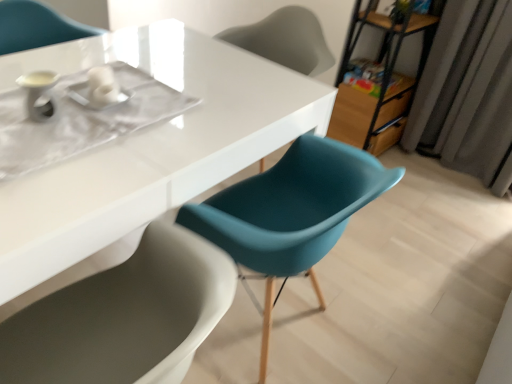
At what (x,y) coordinates should I click in order to perform the action: click on free spot above white glossy table at center (from a real-world perspective). Please return your answer as a coordinate pair (x, y). The height and width of the screenshot is (384, 512). Looking at the image, I should click on (110, 105).